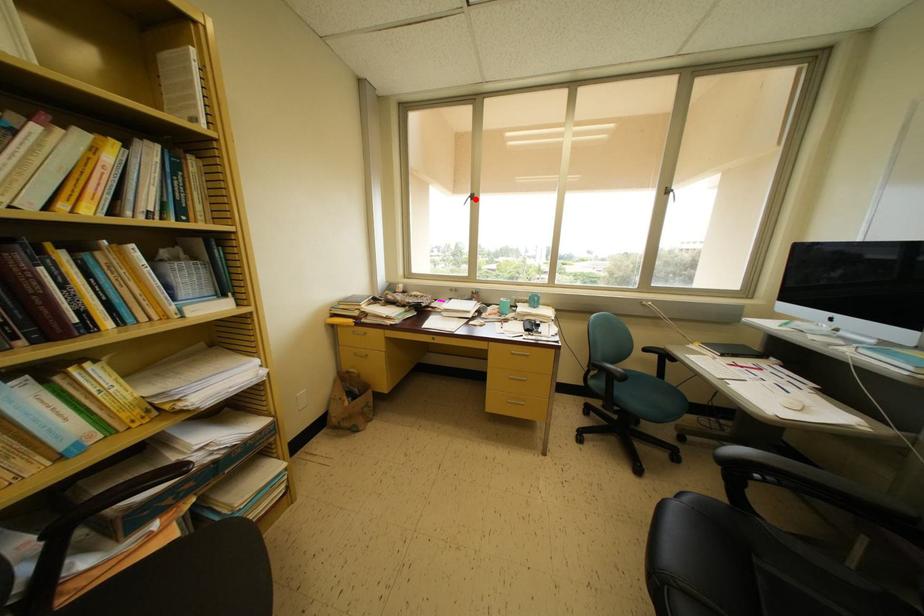
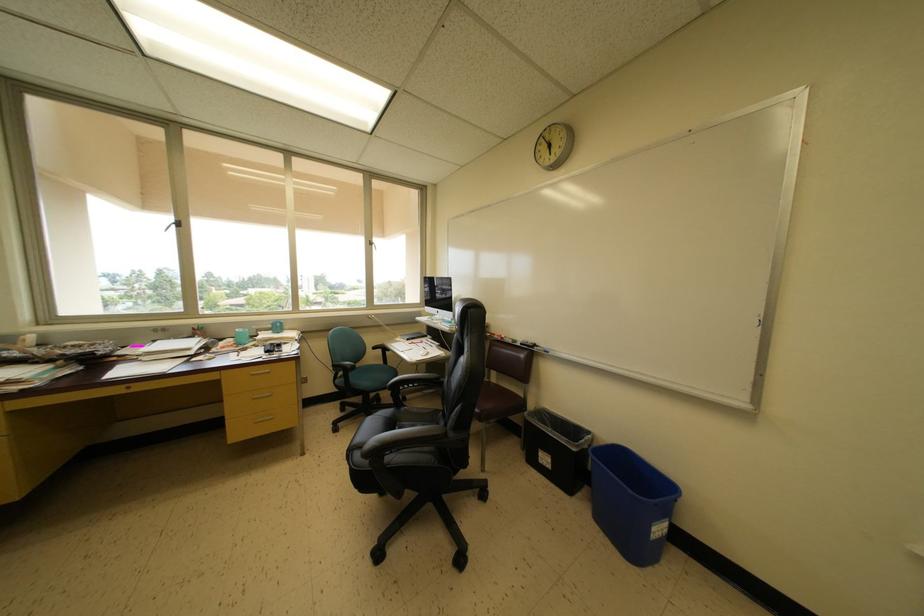
Find the pixel in the second image that matches the highlighted location in the first image.

(179, 225)